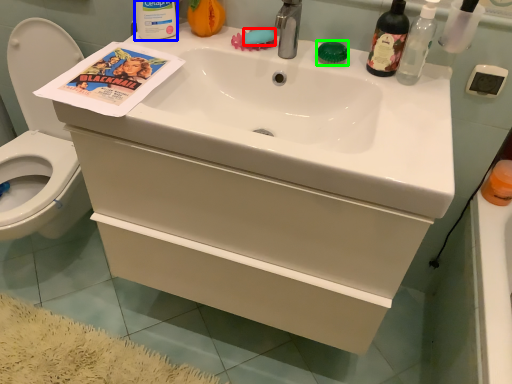
Question: Estimate the real-world distances between objects in this image. Which object is closer to soap (highlighted by a red box), bottle (highlighted by a blue box) or soap (highlighted by a green box)?

Choices:
 (A) bottle
 (B) soap

Answer: (B)